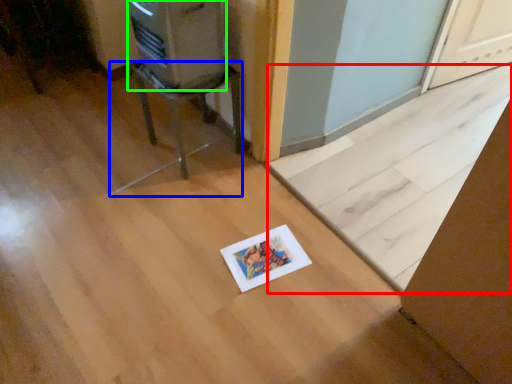
Question: Which object is positioned closest to doormat (highlighted by a red box)? Select from furniture (highlighted by a blue box) and appliance (highlighted by a green box).

Choices:
 (A) furniture
 (B) appliance

Answer: (A)